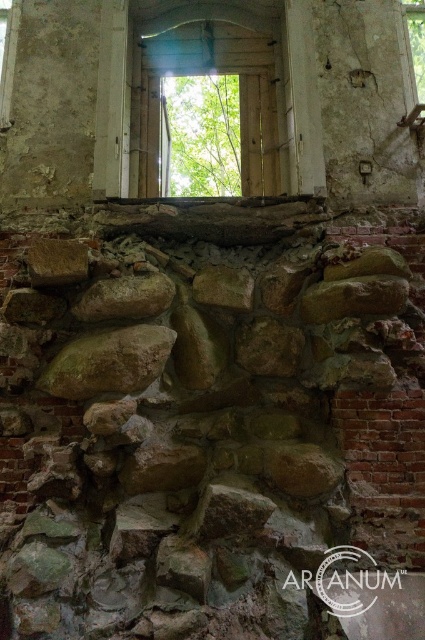
You are standing in front of the old wall and want to pass through the transparent wooden door at upper center. Is the brown rough stone at center blocking your path?

The transparent wooden door at upper center is further to the viewer than brown rough stone at center, so the brown rough stone at center is behind the door and not blocking the path.